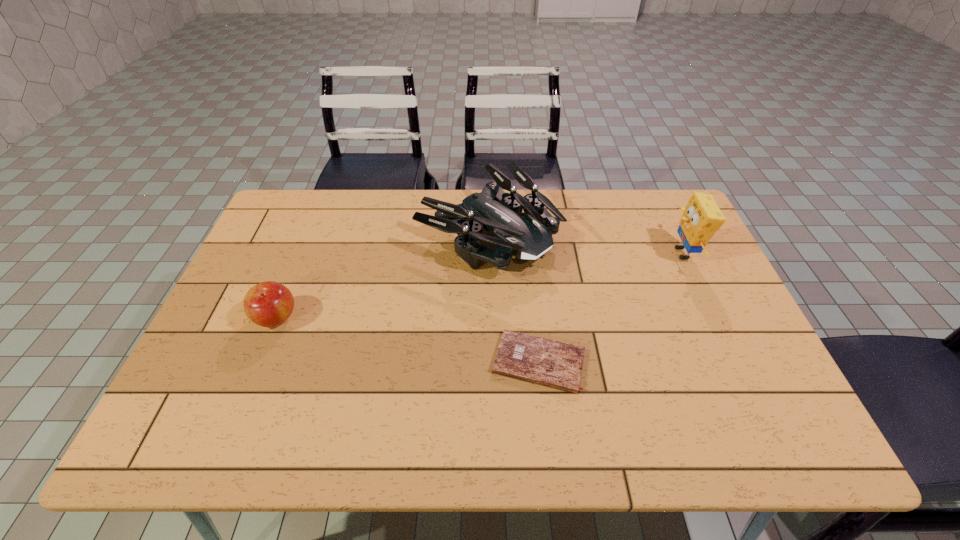
Locate an element on the screen. free space between the sponge and the apple is located at coordinates (479, 286).

Find the location of a particular element. free area in between the leftmost object and the tallest object is located at coordinates (479, 286).

Select which object is the third closest to the drone. Please provide its 2D coordinates. Your answer should be formatted as a tuple, i.e. [(x, y)], where the tuple contains the x and y coordinates of a point satisfying the conditions above.

[(701, 218)]

Identify the location of the second closest object to the drone. This screenshot has height=540, width=960. pyautogui.click(x=267, y=304).

Find the location of a particular element. The image size is (960, 540). vacant space that satisfies the following two spatial constraints: 1. on the back side of the apple; 2. on the right side of the drone is located at coordinates (310, 235).

Identify the location of vacant position in the image that satisfies the following two spatial constraints: 1. on the front side of the Bible; 2. on the right side of the apple. The image size is (960, 540). (x=258, y=362).

Find the location of a particular element. This screenshot has height=540, width=960. vacant area that satisfies the following two spatial constraints: 1. on the front side of the drone; 2. on the right side of the shortest object is located at coordinates (492, 362).

This screenshot has width=960, height=540. I want to click on vacant position in the image that satisfies the following two spatial constraints: 1. on the front side of the apple; 2. on the left side of the shortest object, so click(258, 362).